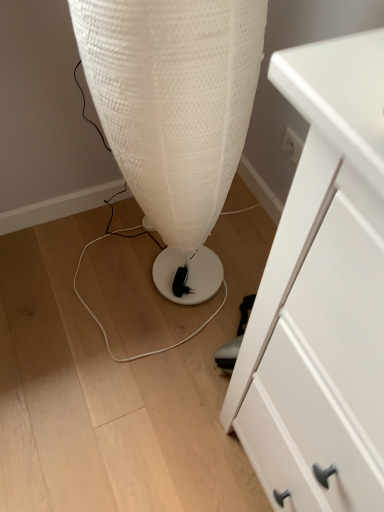
You are a GUI agent. You are given a task and a screenshot of the screen. Output one action in this format:
    pyautogui.click(x=<x>, y=<y>)
    Task: Click on the vacant space to the left of white mesh lamp at center
    This screenshot has width=384, height=512.
    Given the screenshot: What is the action you would take?
    pyautogui.click(x=84, y=274)